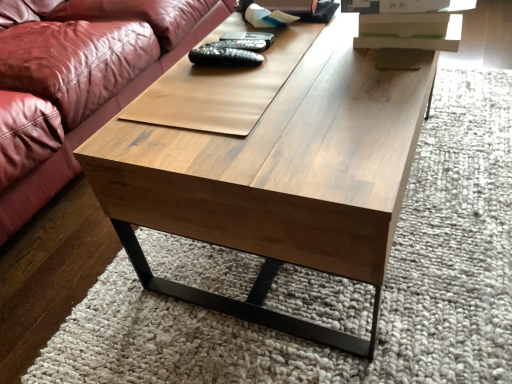
You are a GUI agent. You are given a task and a screenshot of the screen. Output one action in this format:
    pyautogui.click(x=<x>, y=<y>)
    Task: Click on the vacant region in front of black matte remote at center, the 3th remote when ordered from top to bottom
    This screenshot has height=384, width=512.
    Given the screenshot: What is the action you would take?
    pyautogui.click(x=231, y=98)